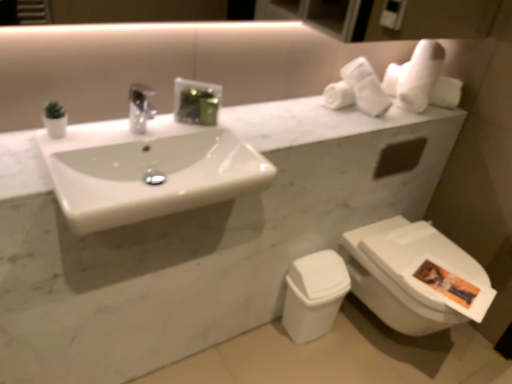
Question: From the image's perspective, is white plastic toilet bowl at lower right on top of white glossy toilet at lower right?

Choices:
 (A) no
 (B) yes

Answer: (A)

Question: Can you confirm if white plastic toilet bowl at lower right is taller than white glossy toilet at lower right?

Choices:
 (A) no
 (B) yes

Answer: (A)

Question: Does white plastic toilet bowl at lower right have a smaller size compared to white glossy toilet at lower right?

Choices:
 (A) no
 (B) yes

Answer: (B)

Question: Is white plastic toilet bowl at lower right aimed at white glossy toilet at lower right?

Choices:
 (A) yes
 (B) no

Answer: (B)

Question: Is white plastic toilet bowl at lower right placed right next to white glossy toilet at lower right?

Choices:
 (A) no
 (B) yes

Answer: (A)

Question: From a real-world perspective, is white plastic toilet bowl at lower right positioned under white glossy toilet at lower right based on gravity?

Choices:
 (A) no
 (B) yes

Answer: (B)

Question: From a real-world perspective, is white glossy toilet at lower right on top of white plastic toilet bowl at lower right?

Choices:
 (A) yes
 (B) no

Answer: (A)

Question: Can you confirm if white glossy toilet at lower right is shorter than white plastic toilet bowl at lower right?

Choices:
 (A) no
 (B) yes

Answer: (A)

Question: Considering the relative sizes of white glossy toilet at lower right and white plastic toilet bowl at lower right in the image provided, is white glossy toilet at lower right thinner than white plastic toilet bowl at lower right?

Choices:
 (A) yes
 (B) no

Answer: (B)

Question: Is the position of white glossy toilet at lower right more distant than that of white plastic toilet bowl at lower right?

Choices:
 (A) no
 (B) yes

Answer: (A)

Question: Can you confirm if white glossy toilet at lower right is wider than white plastic toilet bowl at lower right?

Choices:
 (A) yes
 (B) no

Answer: (A)

Question: From the image's perspective, is white glossy toilet at lower right above white plastic toilet bowl at lower right?

Choices:
 (A) no
 (B) yes

Answer: (B)

Question: Is white glossy toilet at lower right positioned in front of white soft towel at upper right?

Choices:
 (A) no
 (B) yes

Answer: (B)